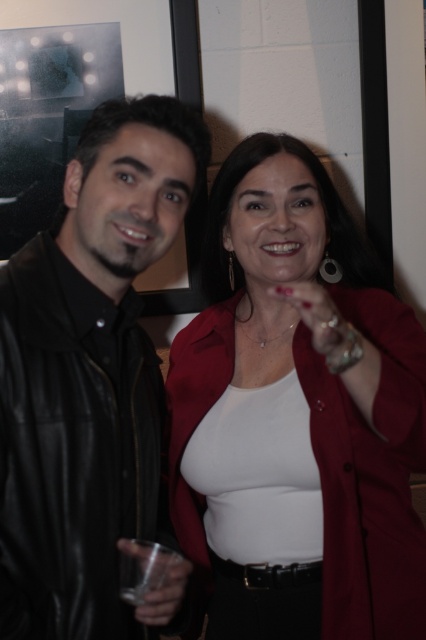
You are at a social event and want to take a photo of both people. The photographer is standing in front of them. Which point, point (330, 464) or point (183, 570), is closer to the photographer?

Point (183, 570) is closer to the photographer because it is in front of point (330, 464).